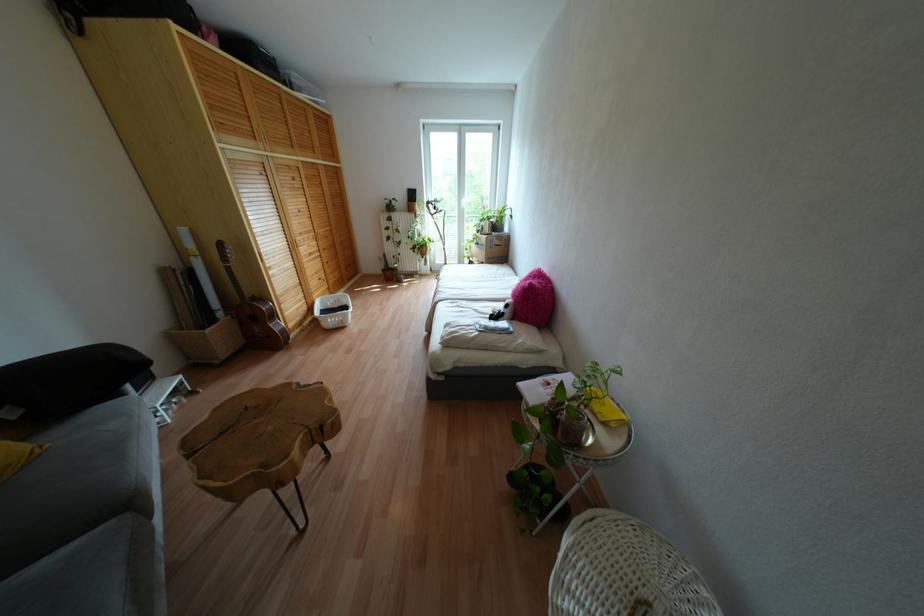
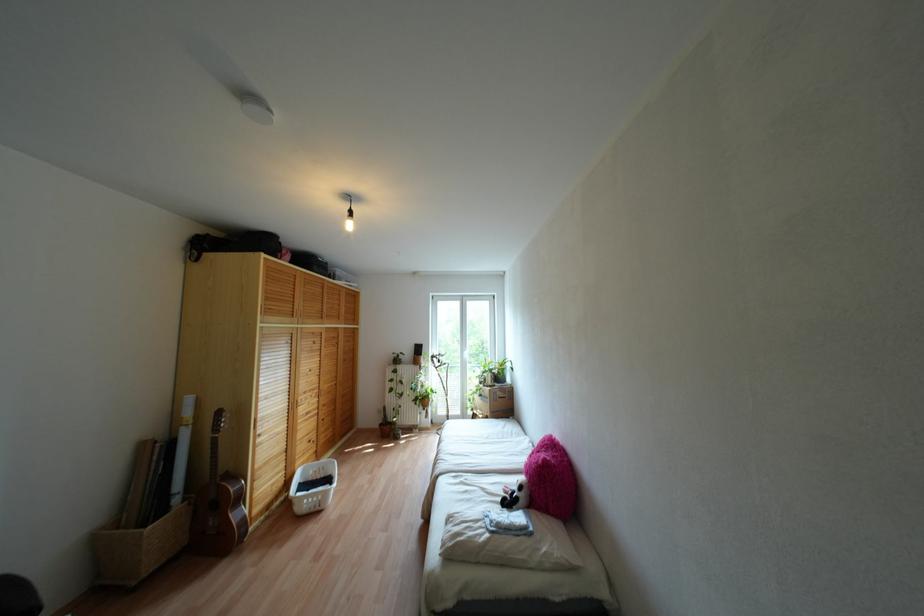
Where in the second image is the point corresponding to (273,314) from the first image?

(238, 498)